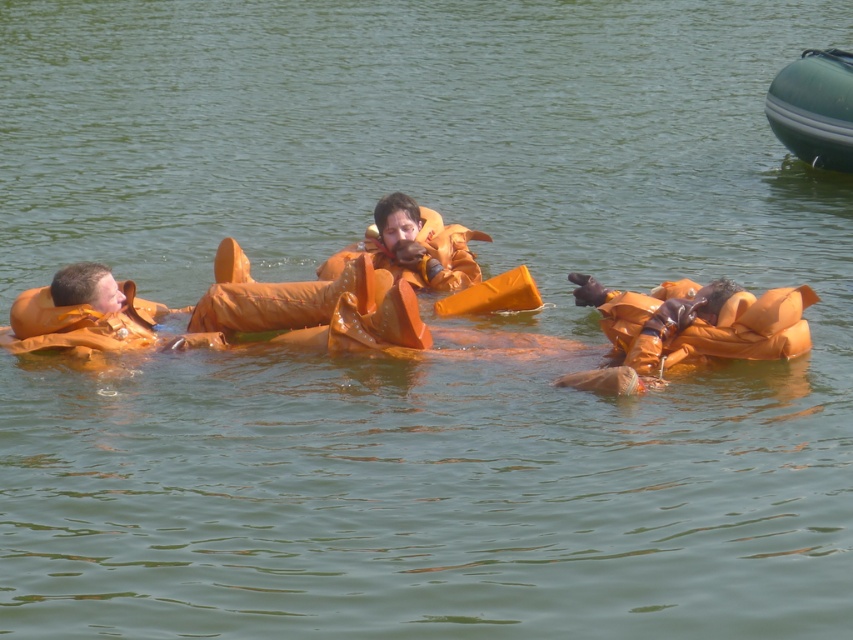
You are a lifeguard assessing the water safety of two individuals. You notice an orange rubber life vest at center and an orange matte life jacket at left. Which life jacket has a higher buoyancy based on their sizes?

The orange rubber life vest at center has higher buoyancy because it is much taller than the orange matte life jacket at left, indicating greater volume and thus better flotation.